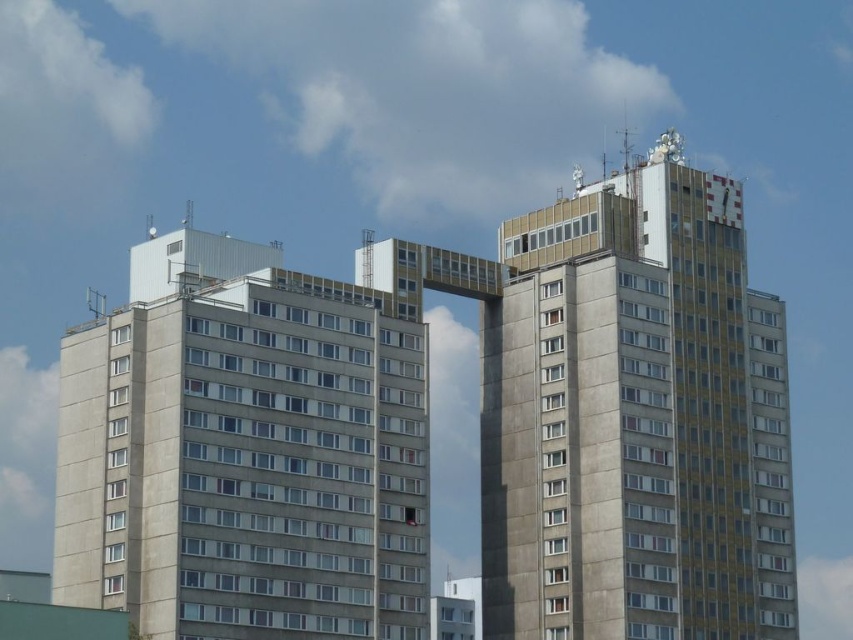
Question: Is yellowish concrete building at upper right positioned at the back of gray concrete building at left?

Choices:
 (A) yes
 (B) no

Answer: (A)

Question: Is yellowish concrete building at upper right smaller than gray concrete building at left?

Choices:
 (A) no
 (B) yes

Answer: (B)

Question: Is yellowish concrete building at upper right positioned at the back of gray concrete building at left?

Choices:
 (A) yes
 (B) no

Answer: (A)

Question: Which object is farther from the camera taking this photo?

Choices:
 (A) gray concrete building at left
 (B) yellowish concrete building at upper right

Answer: (B)

Question: Which point appears farthest from the camera in this image?

Choices:
 (A) (383, 326)
 (B) (628, 220)

Answer: (B)